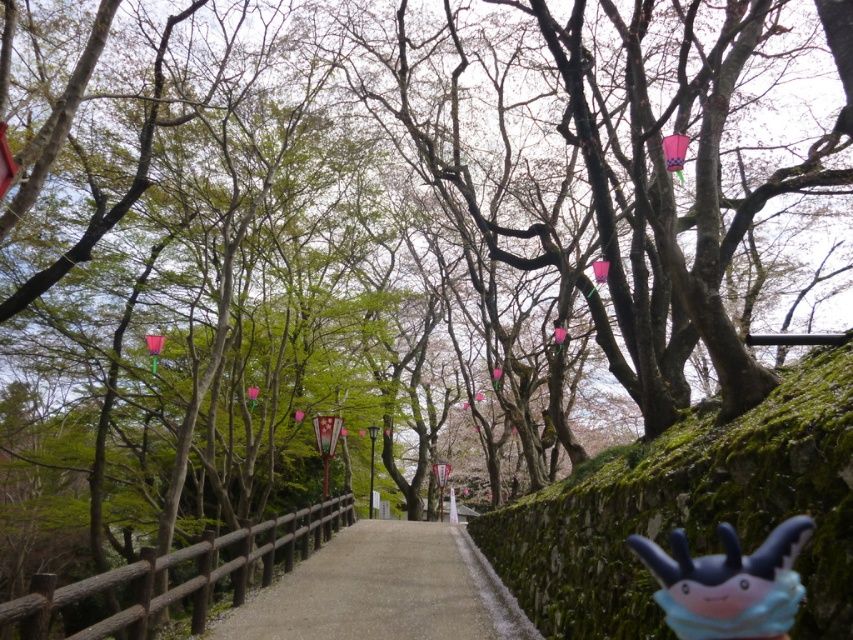
Question: From the image, what is the correct spatial relationship of brown wooden fence at center in relation to blue plush toy at lower right?

Choices:
 (A) left
 (B) right

Answer: (A)

Question: Which point is farther to the camera?

Choices:
 (A) (793, 577)
 (B) (451, 632)
 (C) (254, 561)

Answer: (C)

Question: Is the position of smooth concrete path at center less distant than that of blue plush toy at lower right?

Choices:
 (A) no
 (B) yes

Answer: (A)

Question: Does brown wooden fence at center appear on the right side of blue plush toy at lower right?

Choices:
 (A) yes
 (B) no

Answer: (B)

Question: Which point is closer to the camera?

Choices:
 (A) blue plush toy at lower right
 (B) smooth concrete path at center
 (C) brown wooden fence at center

Answer: (A)

Question: Which object is the closest to the blue plush toy at lower right?

Choices:
 (A) smooth concrete path at center
 (B) brown wooden fence at center

Answer: (B)